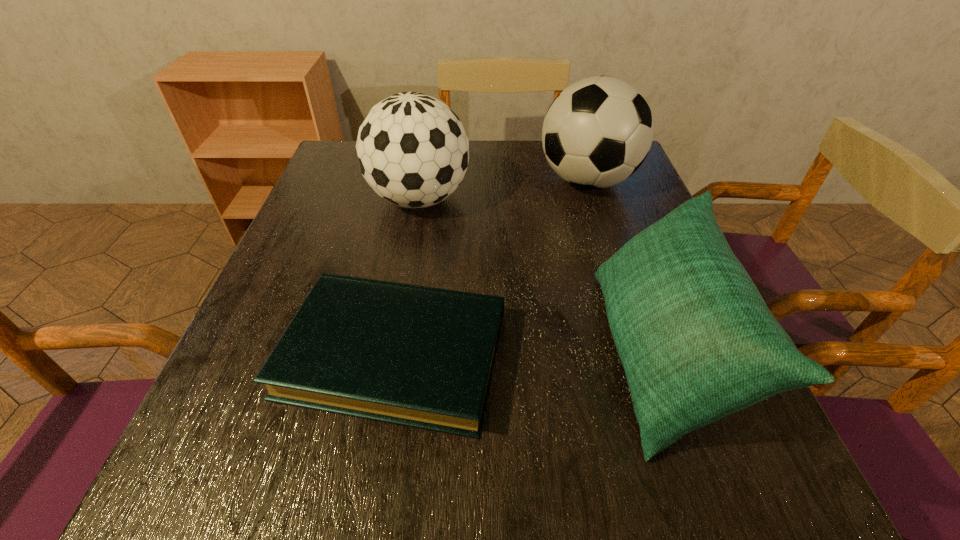
Image resolution: width=960 pixels, height=540 pixels. I want to click on the right soccer ball, so click(x=597, y=132).

This screenshot has height=540, width=960. Find the location of `the left soccer ball`. the left soccer ball is located at coordinates (413, 151).

Locate an element on the screen. Image resolution: width=960 pixels, height=540 pixels. cushion is located at coordinates (697, 342).

Locate an element on the screen. This screenshot has height=540, width=960. book is located at coordinates (418, 356).

This screenshot has height=540, width=960. I want to click on vacant area located on the back of the right soccer ball, so click(x=576, y=146).

This screenshot has width=960, height=540. I want to click on free space located on the left of the left soccer ball, so click(324, 199).

In order to click on free location located 0.280m on the front-facing side of the second shortest object in this screenshot , I will do `click(434, 353)`.

Where is `free space located 0.380m on the front-facing side of the second shortest object`? This screenshot has height=540, width=960. free space located 0.380m on the front-facing side of the second shortest object is located at coordinates (375, 353).

The height and width of the screenshot is (540, 960). I want to click on vacant space situated 0.170m on the front-facing side of the second shortest object, so click(x=499, y=353).

Where is `vacant space positioned on the right of the shortest object`? vacant space positioned on the right of the shortest object is located at coordinates (564, 355).